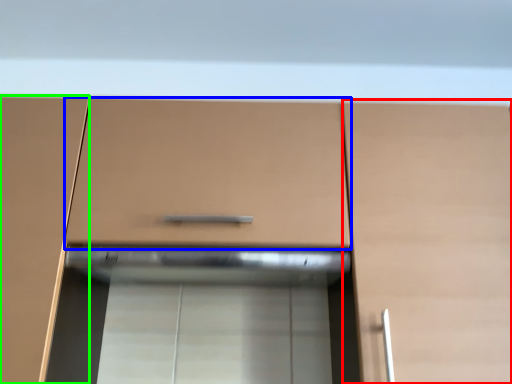
Question: Considering the real-world distances, which object is closest to cabinetry (highlighted by a red box)? drawer (highlighted by a blue box) or cabinetry (highlighted by a green box).

Choices:
 (A) drawer
 (B) cabinetry

Answer: (A)